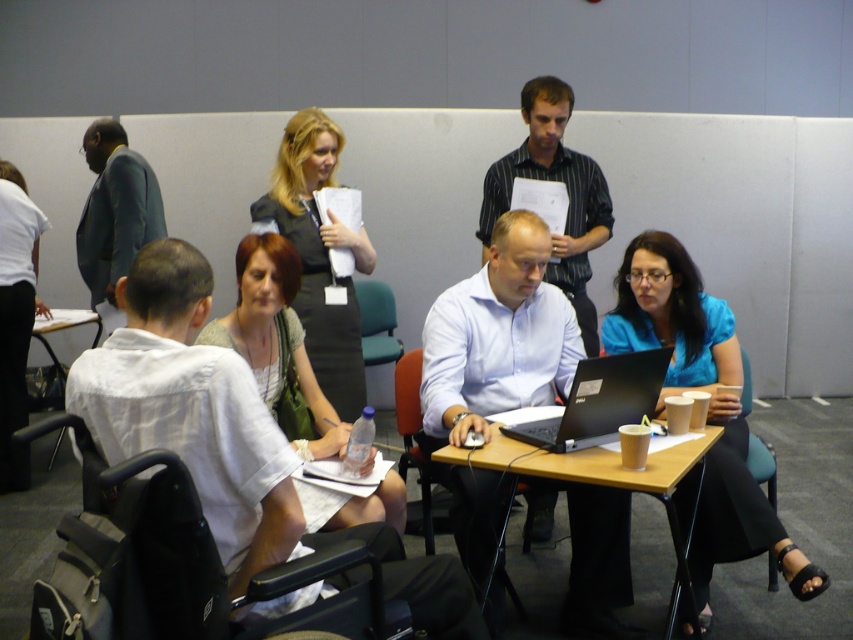
Who is more distant from viewer, [485,456] or [606,371]?

The point [606,371] is more distant.

How distant is wooden table at center from black matte laptop at center?

wooden table at center and black matte laptop at center are 5.28 inches apart from each other.

Does point (492, 448) lie behind point (564, 442)?

Yes, it is.

Identify the location of wooden table at center. Image resolution: width=853 pixels, height=640 pixels. (595, 468).

Is white matte shirt at center to the left of green fabric chair at center from the viewer's perspective?

In fact, white matte shirt at center is to the right of green fabric chair at center.

Is the position of white matte shirt at center less distant than that of green fabric chair at center?

Yes, white matte shirt at center is in front of green fabric chair at center.

Which is in front, point (86, 422) or point (369, 321)?

Point (86, 422)

The image size is (853, 640). What are the coordinates of `white matte shirt at center` in the screenshot? It's located at (192, 410).

Can you confirm if wooden table at center is thinner than red leather chair at center?

No.

Who is positioned more to the right, wooden table at center or red leather chair at center?

wooden table at center

Who is more distant from viewer, (x=595, y=481) or (x=427, y=513)?

The point (x=427, y=513) is behind.

The image size is (853, 640). I want to click on wooden table at center, so click(595, 468).